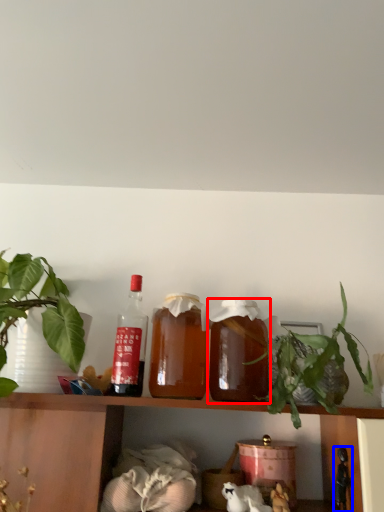
Question: Which object appears closest to the camera in this image, bottle (highlighted by a red box) or toy (highlighted by a blue box)?

Choices:
 (A) bottle
 (B) toy

Answer: (B)